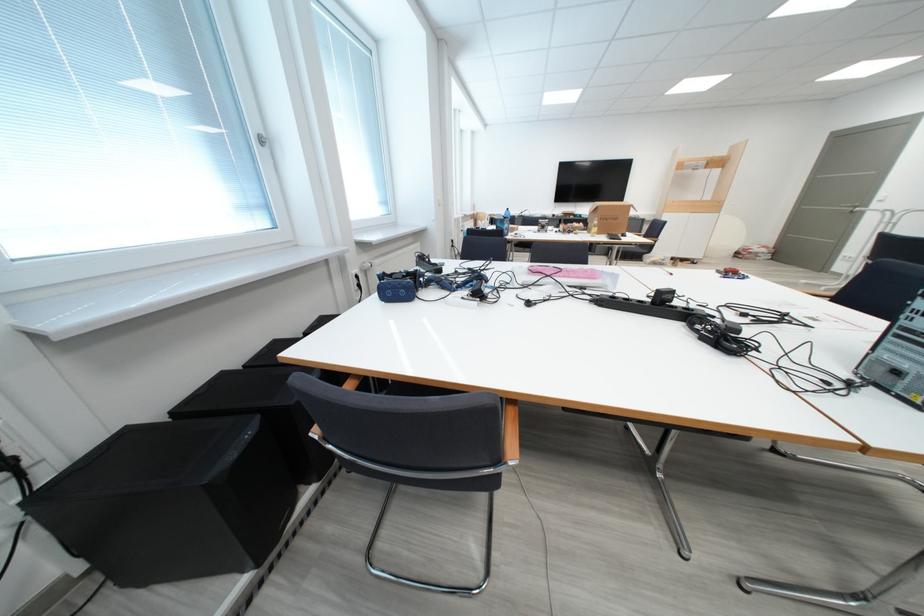
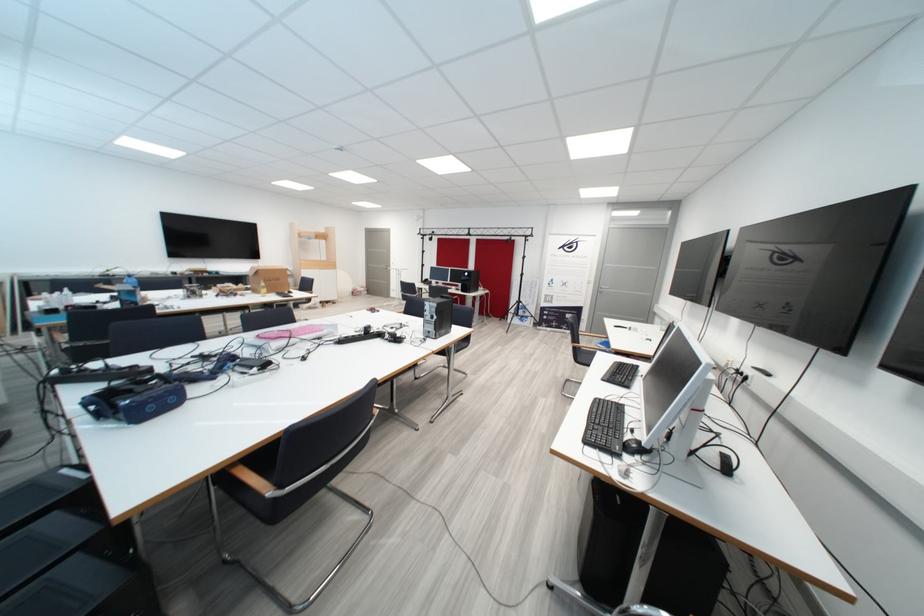
Locate, in the second image, the point that corresponds to point 606,212 in the first image.

(268, 275)